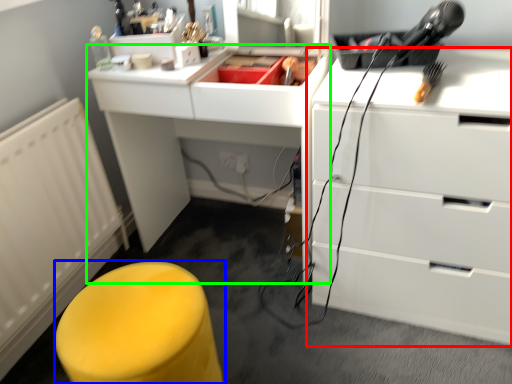
Question: Based on their relative distances, which object is farther from chest of drawers (highlighted by a red box)? Choose from furniture (highlighted by a blue box) and computer desk (highlighted by a green box).

Choices:
 (A) furniture
 (B) computer desk

Answer: (A)